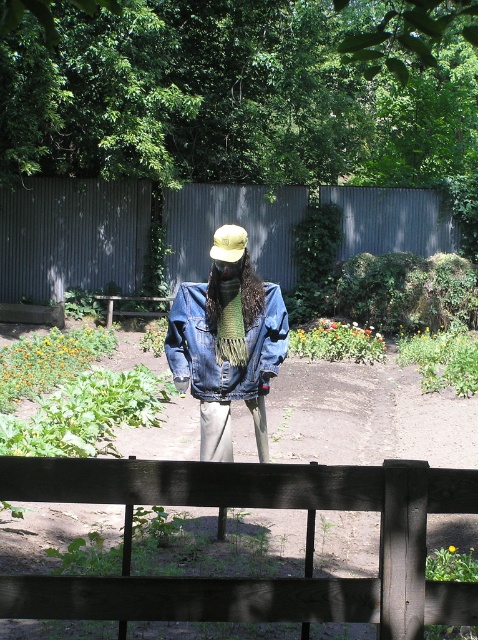
Locate an element on the screen. This screenshot has width=478, height=640. metallic gray fence at center is located at coordinates (72, 236).

Can you confirm if metallic gray fence at center is wider than denim jacket at center?

Yes.

Is point (213, 227) behind point (189, 301)?

Yes.

The height and width of the screenshot is (640, 478). In order to click on metallic gray fence at center in this screenshot , I will do `click(72, 236)`.

Does black wood fence at center appear over metallic gray fence at center?

Incorrect, black wood fence at center is not positioned above metallic gray fence at center.

How far apart are black wood fence at center and metallic gray fence at center?

18.10 meters

Does point (452, 497) lie behind point (203, 275)?

That is False.

What are the coordinates of `black wood fence at center` in the screenshot? It's located at (252, 508).

Is denim jacket at center in front of wooden park bench at center?

Yes.

Which is in front, point (183, 332) or point (134, 298)?

Point (183, 332) is in front.

Find the location of a particular element. denim jacket at center is located at coordinates (215, 346).